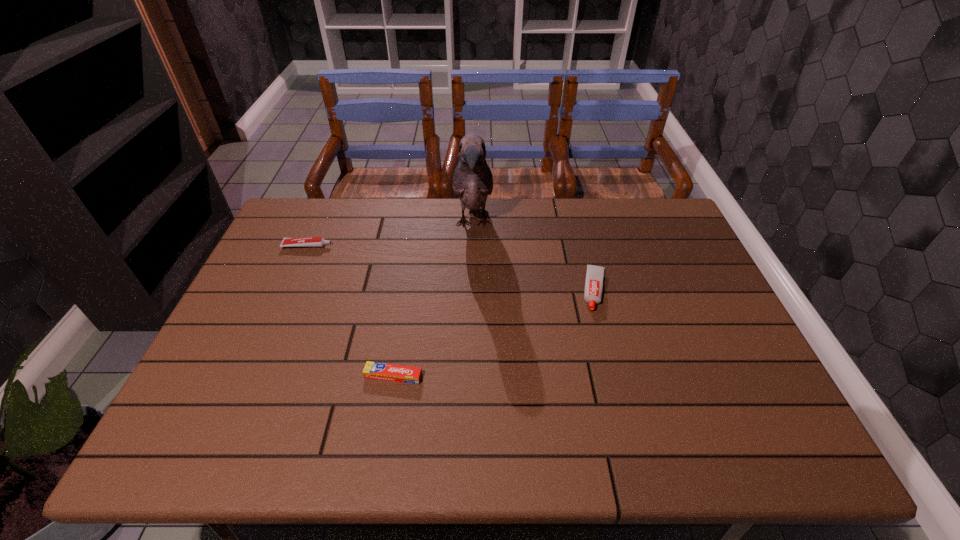
Identify the location of free space that satisfies the following two spatial constraints: 1. at the nozzle of the shortest toothpaste; 2. on the left side of the second shortest object. Image resolution: width=960 pixels, height=540 pixels. (251, 376).

Find the location of a particular element. This screenshot has height=540, width=960. vacant space that satisfies the following two spatial constraints: 1. at the nozzle of the rightmost toothpaste; 2. on the left side of the leftmost toothpaste is located at coordinates (288, 290).